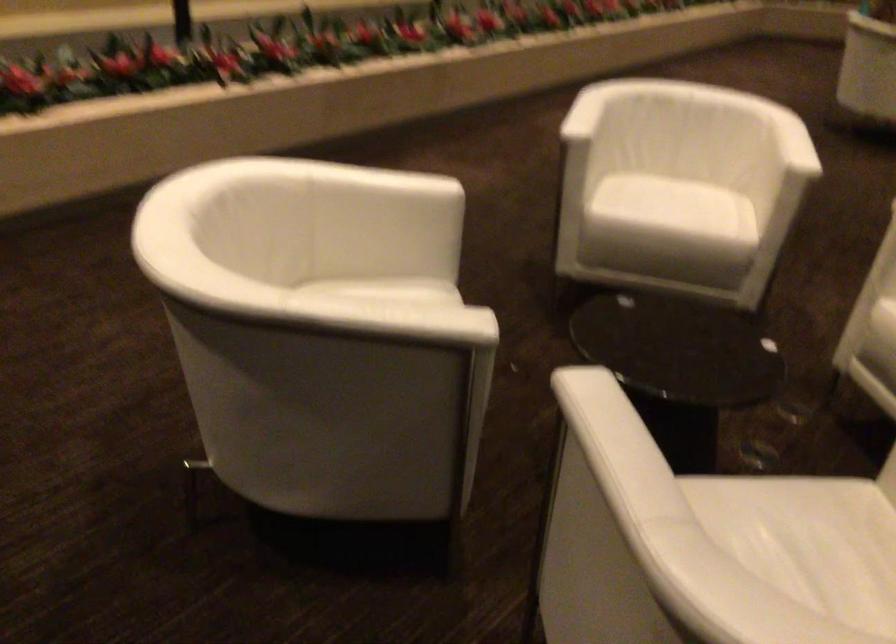
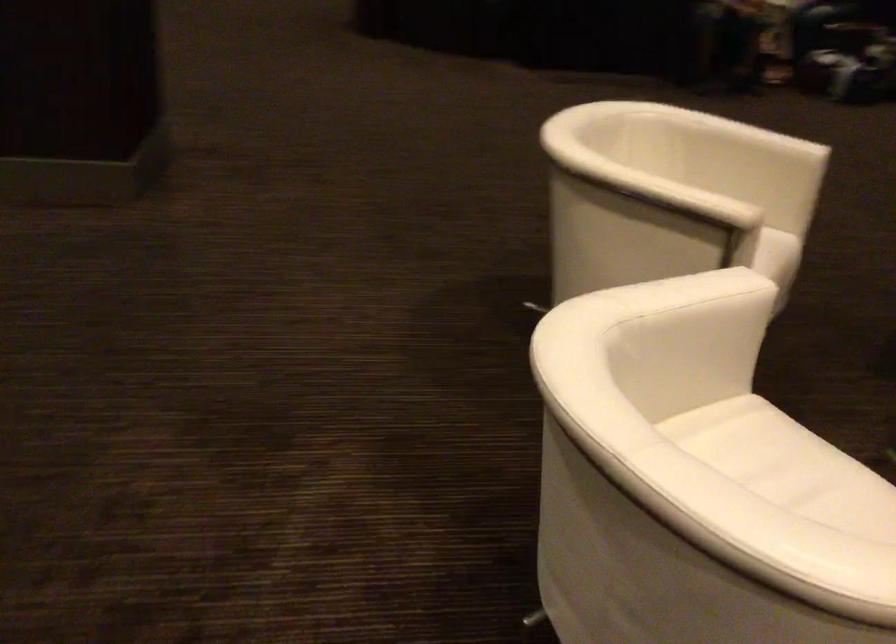
Where in the second image is the point corresponding to point 701,194 from the first image?

(767, 453)